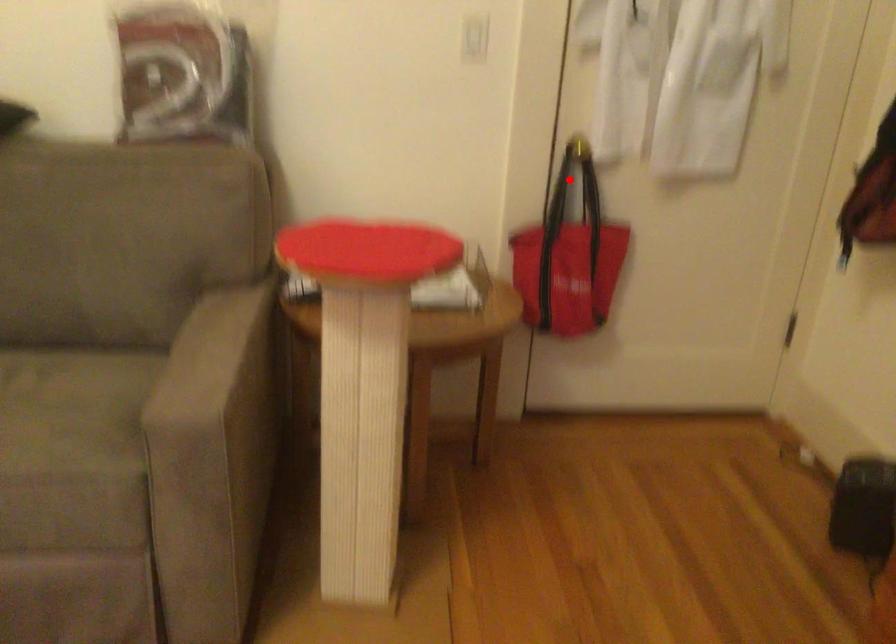
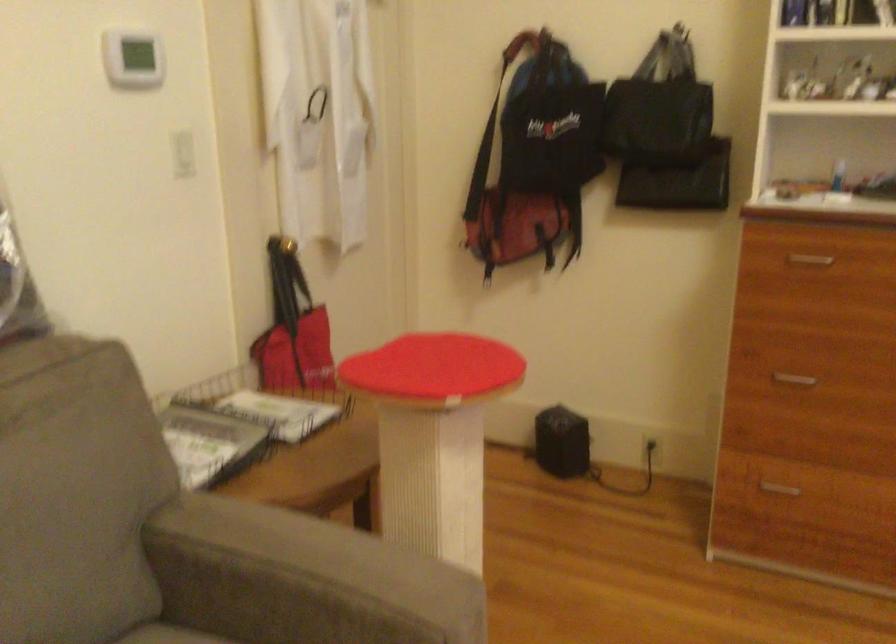
In the second image, find the point that corresponds to the highlighted location in the first image.

(286, 281)